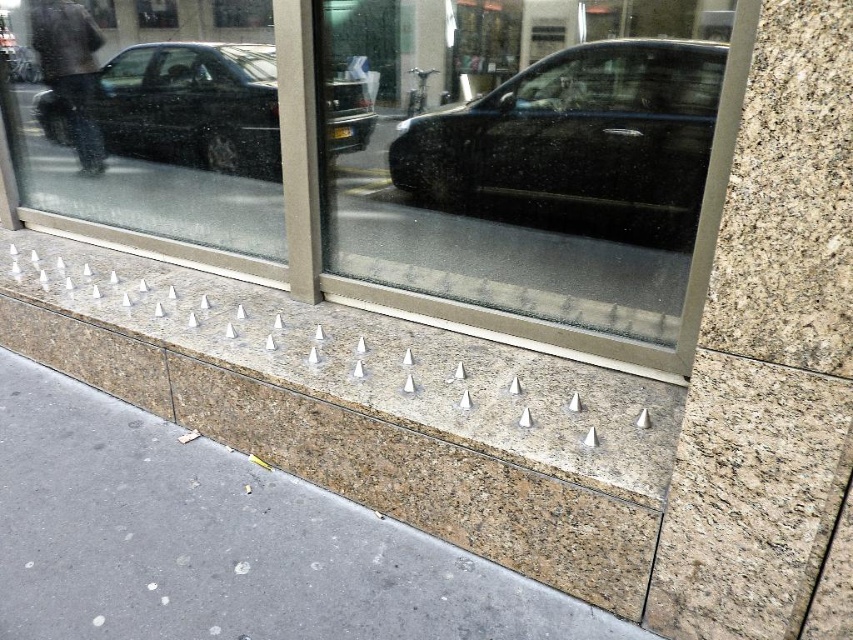
You are standing in front of a store and want to take a photo of the transparent glass shop window at center. Your camera can focus on objects up to 5 feet away. Will you need to adjust your focus to capture the window clearly?

The transparent glass shop window at center is 4.85 feet from the camera, which is within the 5 feet focus range. Therefore, you do not need to adjust the focus to capture the window clearly.

You are a delivery robot that is 3 feet wide. You need to move from the sidewalk to the storefront entrance, which is behind the silver metallic spikes at center and black glossy car at center. Can you fit through the space between them?

The silver metallic spikes at center is 3.78 feet from the black glossy car at center, so yes, the robot can fit through the space between them since it is wider than the robot.

You are a window cleaner standing on the sidewalk and looking at the storefront. You see the silver metallic spikes at center and the shiny black car at upper left reflected in the window. Which object is taller in the reflection?

The silver metallic spikes at center is much taller as shiny black car at upper left in the reflection.